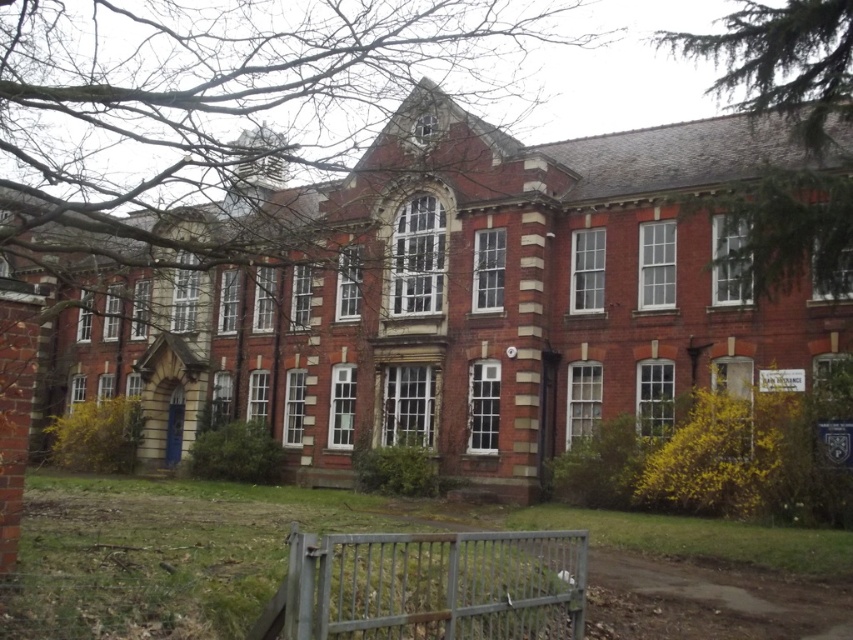
Between bare branches at upper center and metallic gate at lower center, which one has less height?

With less height is metallic gate at lower center.

The width and height of the screenshot is (853, 640). What do you see at coordinates (212, 90) in the screenshot?
I see `bare branches at upper center` at bounding box center [212, 90].

Is point (318, 77) closer to viewer compared to point (491, 600)?

That is False.

At what (x,y) coordinates should I click in order to perform the action: click on bare branches at upper center. Please return your answer as a coordinate pair (x, y). The width and height of the screenshot is (853, 640). Looking at the image, I should click on (212, 90).

Can you confirm if metallic gate at lower center is thinner than green textured tree at upper right?

In fact, metallic gate at lower center might be wider than green textured tree at upper right.

Is metallic gate at lower center to the left of green textured tree at upper right from the viewer's perspective?

Correct, you'll find metallic gate at lower center to the left of green textured tree at upper right.

The image size is (853, 640). Describe the element at coordinates (433, 586) in the screenshot. I see `metallic gate at lower center` at that location.

Where is `metallic gate at lower center`? metallic gate at lower center is located at coordinates (433, 586).

Does bare branches at upper center appear on the right side of green textured tree at upper right?

Incorrect, bare branches at upper center is not on the right side of green textured tree at upper right.

Who is positioned more to the right, bare branches at upper center or green textured tree at upper right?

green textured tree at upper right is more to the right.

Based on the photo, measure the distance between point (x=107, y=234) and camera.

Point (x=107, y=234) and camera are 158.84 feet apart.

Locate an element on the screen. bare branches at upper center is located at coordinates (212, 90).